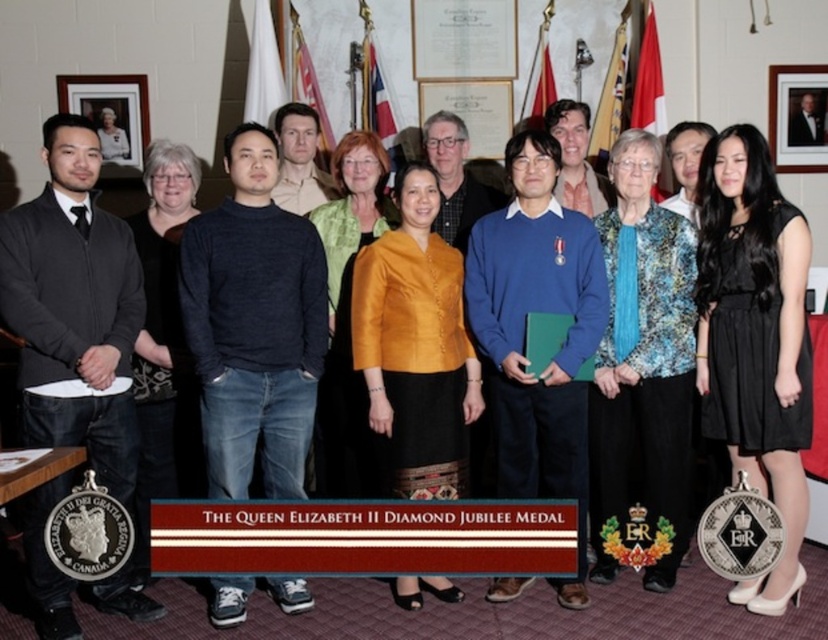
You are a photographer who needs to adjust the lighting to highlight the black satin dress at center. Since you can only adjust the light intensity at the point specified by the coordinates point (754, 340), will adjusting the light at this point effectively illuminate the black satin dress at center?

Yes, adjusting the light at point (754, 340) will effectively illuminate the black satin dress at center because the point corresponds to that object.

You are organizing a photo shoot and need to ensure that all clothing items are visible. Given that the blue sweater at center and the blue printed blouse at center are both in the frame, which clothing item might require more space to be fully visible due to its size?

The blue sweater at center has a larger size compared to the blue printed blouse at center, so it might require more space to be fully visible.